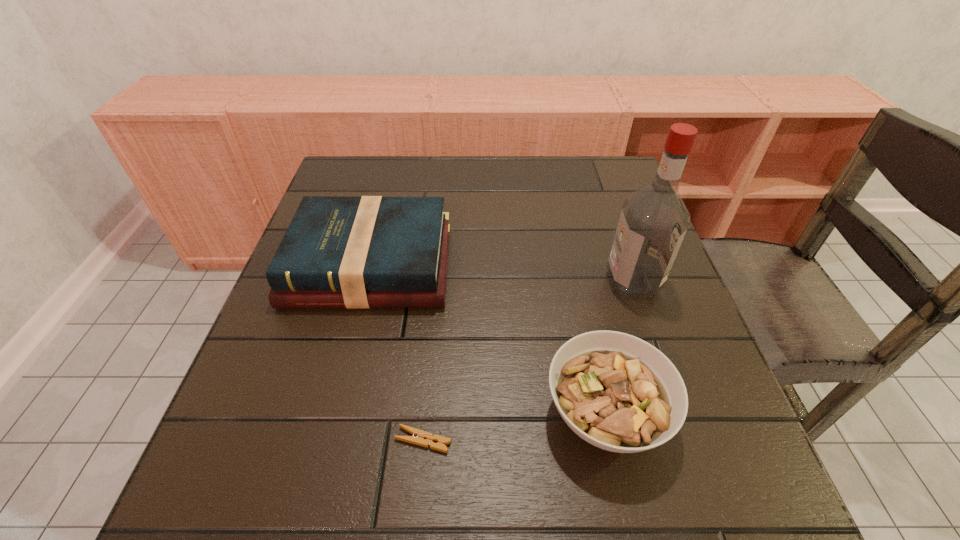
This screenshot has width=960, height=540. Identify the location of free spot at the far right corner of the desktop. (588, 161).

At what (x,y) coordinates should I click in order to perform the action: click on vacant space at the near right corner of the desktop. Please return your answer as a coordinate pair (x, y). This screenshot has width=960, height=540. Looking at the image, I should click on (756, 466).

Where is `free space between the stew and the hardback book`? This screenshot has width=960, height=540. free space between the stew and the hardback book is located at coordinates 488,339.

This screenshot has width=960, height=540. I want to click on free space between the stew and the hardback book, so click(488, 339).

The width and height of the screenshot is (960, 540). Find the location of `empty space that is in between the stew and the hardback book`. empty space that is in between the stew and the hardback book is located at coordinates (488, 339).

The image size is (960, 540). I want to click on vacant space that's between the clothespin and the liquor, so click(528, 361).

Locate an element on the screen. free space between the clothespin and the tallest object is located at coordinates (528, 361).

This screenshot has height=540, width=960. What are the coordinates of `free spot between the clothespin and the tallest object` in the screenshot? It's located at 528,361.

At what (x,y) coordinates should I click in order to perform the action: click on blank region between the stew and the hardback book. Please return your answer as a coordinate pair (x, y). Looking at the image, I should click on (488, 339).

Locate an element on the screen. object that is the second closest to the stew is located at coordinates (654, 219).